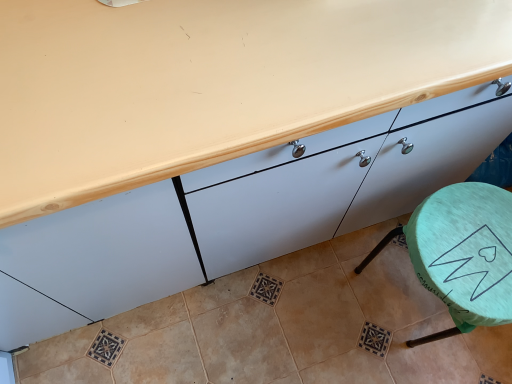
Describe the element at coordinates (462, 254) in the screenshot. The width and height of the screenshot is (512, 384). I see `green fabric stool at lower right` at that location.

The width and height of the screenshot is (512, 384). Identify the location of green fabric stool at lower right. (462, 254).

The width and height of the screenshot is (512, 384). I want to click on matte white cabinet at center, so click(238, 213).

Measure the distance between matte white cabinet at center and camera.

matte white cabinet at center and camera are 23.95 inches apart from each other.

Describe the element at coordinates (238, 213) in the screenshot. Image resolution: width=512 pixels, height=384 pixels. I see `matte white cabinet at center` at that location.

Locate an element on the screen. green fabric stool at lower right is located at coordinates (462, 254).

Which is more to the right, green fabric stool at lower right or matte white cabinet at center?

Positioned to the right is green fabric stool at lower right.

Between green fabric stool at lower right and matte white cabinet at center, which one is positioned behind?

green fabric stool at lower right is more distant.

Is point (490, 292) positioned before point (36, 306)?

Yes, point (490, 292) is in front of point (36, 306).

From the image's perspective, is green fabric stool at lower right located above or below matte white cabinet at center?

From the image's perspective, green fabric stool at lower right appears below matte white cabinet at center.

From a real-world perspective, relative to matte white cabinet at center, is green fabric stool at lower right vertically above or below?

Clearly, from a real-world perspective, green fabric stool at lower right is below matte white cabinet at center.

Considering the sizes of objects green fabric stool at lower right and matte white cabinet at center in the image provided, who is thinner, green fabric stool at lower right or matte white cabinet at center?

With smaller width is green fabric stool at lower right.

Between green fabric stool at lower right and matte white cabinet at center, which one has less height?

green fabric stool at lower right.

Can you confirm if green fabric stool at lower right is bigger than matte white cabinet at center?

No, green fabric stool at lower right is not bigger than matte white cabinet at center.

Is green fabric stool at lower right positioned beyond the bounds of matte white cabinet at center?

That's correct, green fabric stool at lower right is outside of matte white cabinet at center.

Is green fabric stool at lower right beside matte white cabinet at center?

green fabric stool at lower right is not next to matte white cabinet at center, and they're not touching.

Is matte white cabinet at center at the back of green fabric stool at lower right?

Absolutely, green fabric stool at lower right is directed away from matte white cabinet at center.

Image resolution: width=512 pixels, height=384 pixels. In the image, there is a green fabric stool at lower right. In order to click on cabinetry above it (from the image's perspective) in this screenshot , I will do `click(238, 213)`.

Is matte white cabinet at center at the right side of green fabric stool at lower right?

No, matte white cabinet at center is not to the right of green fabric stool at lower right.

Does matte white cabinet at center come behind green fabric stool at lower right?

No, the depth of matte white cabinet at center is less than that of green fabric stool at lower right.

Which is closer to the camera, (x=196, y=171) or (x=459, y=330)?

Point (x=196, y=171) appears to be closer to the viewer than point (x=459, y=330).

From the image's perspective, is matte white cabinet at center above or below green fabric stool at lower right?

Clearly, from the image's perspective, matte white cabinet at center is above green fabric stool at lower right.

From a real-world perspective, is matte white cabinet at center beneath green fabric stool at lower right?

No, from a real-world perspective, matte white cabinet at center is not below green fabric stool at lower right.

Is matte white cabinet at center wider than green fabric stool at lower right?

Correct, the width of matte white cabinet at center exceeds that of green fabric stool at lower right.

Who is shorter, matte white cabinet at center or green fabric stool at lower right?

With less height is green fabric stool at lower right.

Which of these two, matte white cabinet at center or green fabric stool at lower right, is bigger?

matte white cabinet at center.

Is matte white cabinet at center spatially inside green fabric stool at lower right, or outside of it?

matte white cabinet at center is spatially situated outside green fabric stool at lower right.

Would you consider matte white cabinet at center to be distant from green fabric stool at lower right?

No, matte white cabinet at center is not far from green fabric stool at lower right.

Is matte white cabinet at center oriented towards green fabric stool at lower right?

Yes, matte white cabinet at center is facing green fabric stool at lower right.

Can you tell me how much matte white cabinet at center and green fabric stool at lower right differ in facing direction?

The facing directions of matte white cabinet at center and green fabric stool at lower right are 2.47e-05 degrees apart.

Measure the distance from matte white cabinet at center to green fabric stool at lower right.

matte white cabinet at center and green fabric stool at lower right are 14.04 inches apart.

Locate an element on the screen. furniture that is on the right side of matte white cabinet at center is located at coordinates (462, 254).

Where is `cabinetry on the left of green fabric stool at lower right`? cabinetry on the left of green fabric stool at lower right is located at coordinates (238, 213).

Find the location of a particular element. The height and width of the screenshot is (384, 512). cabinetry located above the green fabric stool at lower right (from a real-world perspective) is located at coordinates (238, 213).